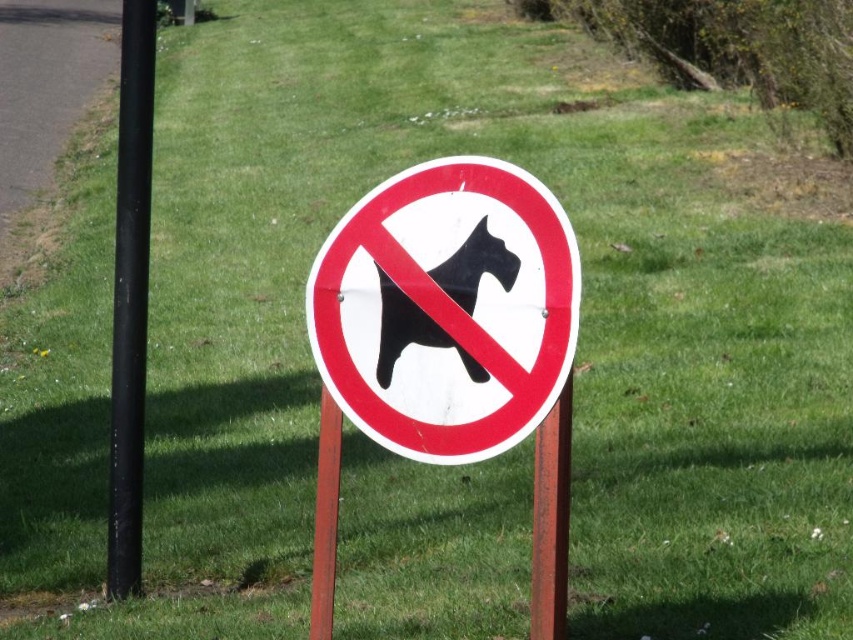
You are a delivery driver who needs to park your vehicle near the white plastic sign at center and the brown wooden post at center. Given that your vehicle requires a parking space wider than the combined width of both objects, can you determine if the space between them is sufficient?

The white plastic sign at center is wider than the brown wooden post at center. However, the question does not provide information about the distance between them or the total required space. Therefore, it is impossible to determine if the parking space is sufficient based on the given details.

You are standing at the center of the image and want to find the white plastic sign at center. According to the coordinates provided, in which direction should you look to see it?

The white plastic sign at center is located at coordinates approximately 0.483 on the x and 0.525 on the y axis. Since the center of the image is at 0.5, the sign is slightly to the left and above the center point.